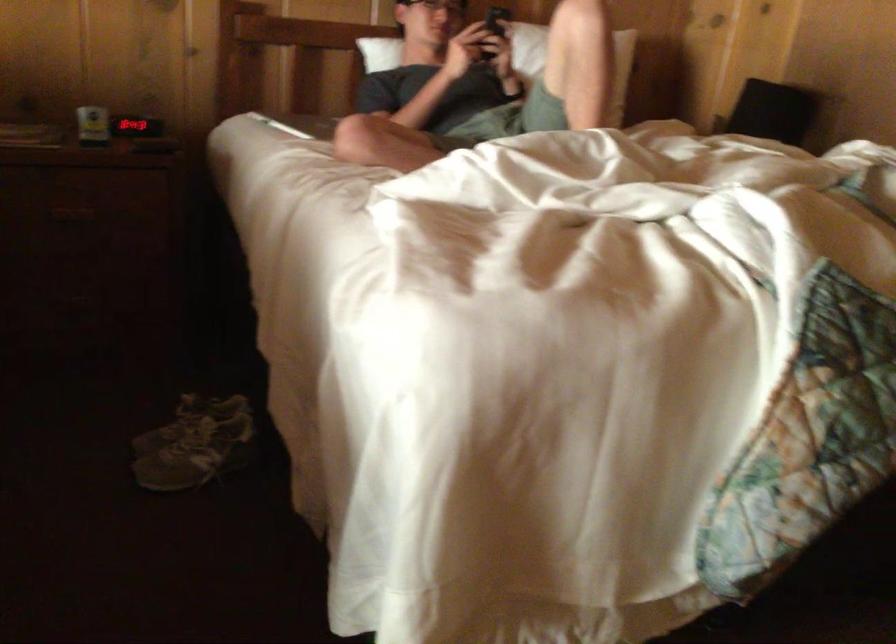
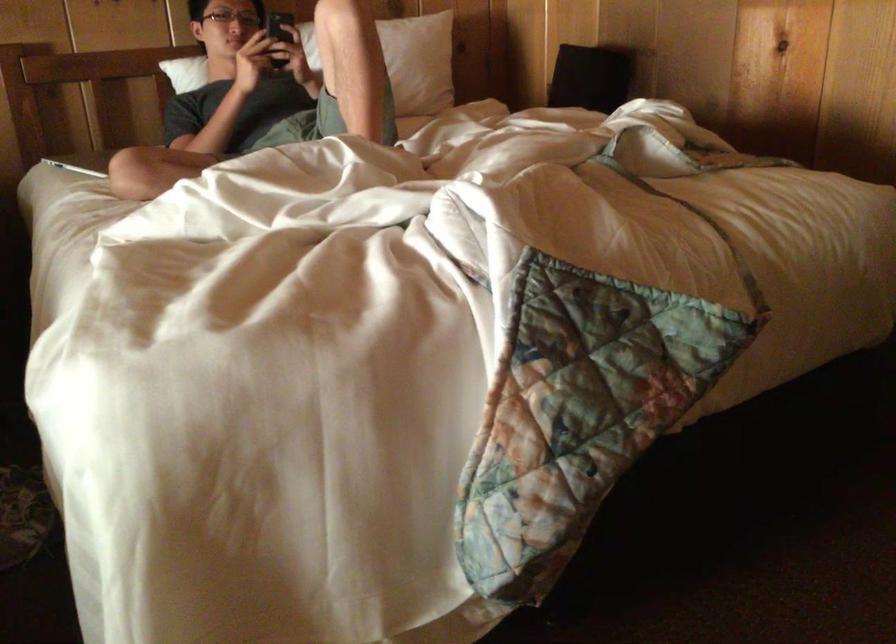
Question: What movement of the cameraman would produce the second image?

Choices:
 (A) Left
 (B) Right
 (C) Forward
 (D) Backward

Answer: (B)